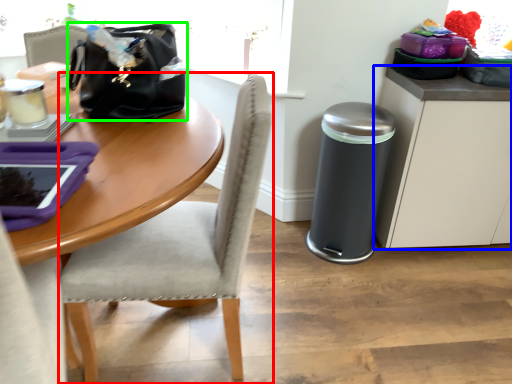
Question: Estimate the real-world distances between objects in this image. Which object is farther from chair (highlighted by a red box), cabinetry (highlighted by a blue box) or handbag (highlighted by a green box)?

Choices:
 (A) cabinetry
 (B) handbag

Answer: (A)